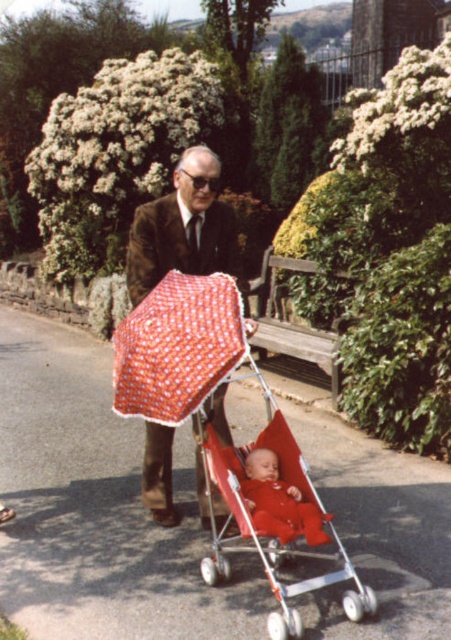
You are a photographer standing at the end of the pathway in the park. You want to take a photo of the brown woolen suit at center and the matte red baby at center. Which object will appear closer to you in the photo?

The brown woolen suit at center will appear closer to you in the photo because it is positioned further to the viewer than the matte red baby at center.

You are a photographer setting up a shot of the elderly man in the park. You need to ensure the red polka dot fabric umbrella at center and the brown woolen suit at center are both in focus. Which object should you adjust your camera focus on first to ensure proper depth of field?

The red polka dot fabric umbrella at center is thinner than the brown woolen suit at center, so you should focus on the brown woolen suit at center first because thicker objects often require more precise focus adjustments to ensure clarity in the final image.

Consider the image. You are a photographer planning to take a portrait of the elderly man and the baby stroller. Since your camera has a limited focus range, you need to know which object is wider to ensure proper framing. Which one is wider between the brown woolen suit at center and the matte red baby at center?

The brown woolen suit at center is wider than the matte red baby at center, so you should frame the photo to accommodate its width.